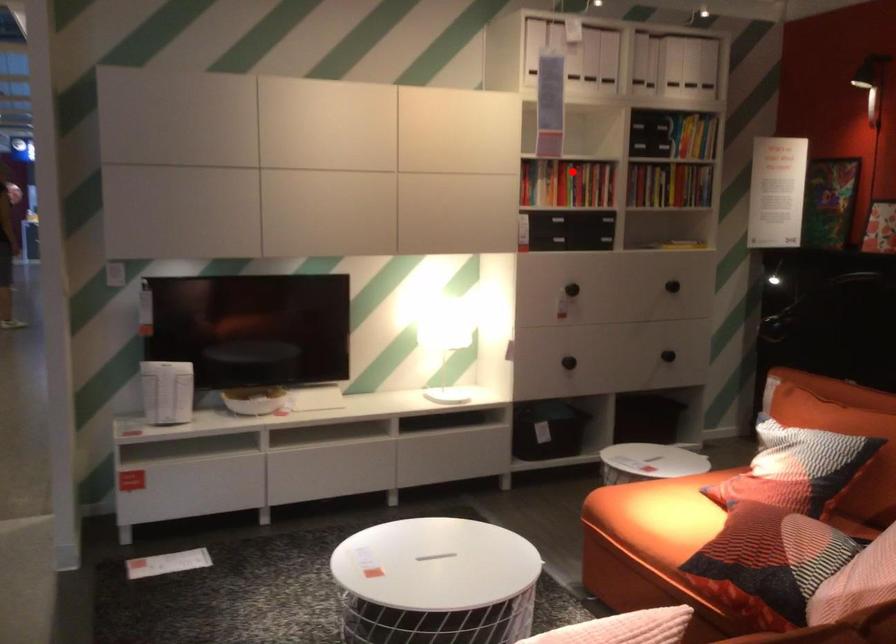
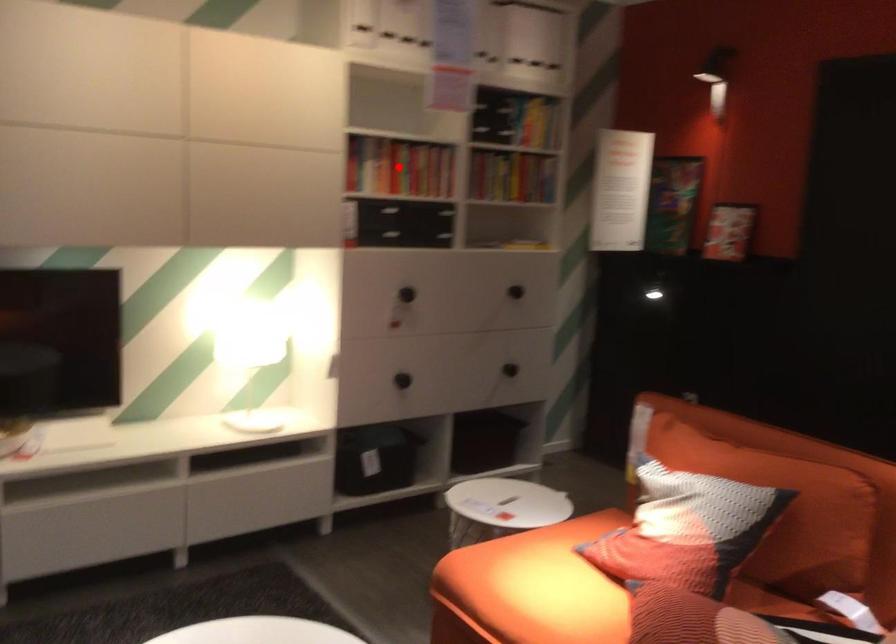
I am providing you with two images of the same scene from different viewpoints. A red point is marked on the first image and another point is marked on the second image. Is the red point in image1 aligned with the point shown in image2?

Yes